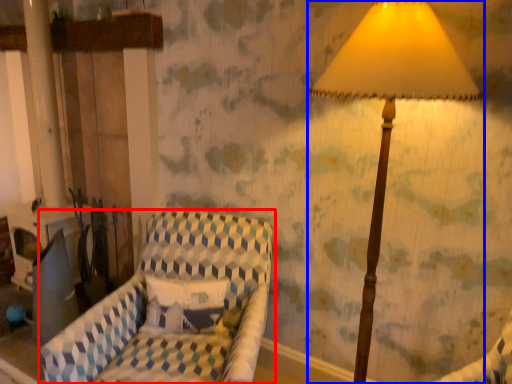
Question: Which of the following is the closest to the observer, furniture (highlighted by a red box) or lamp (highlighted by a blue box)?

Choices:
 (A) furniture
 (B) lamp

Answer: (B)